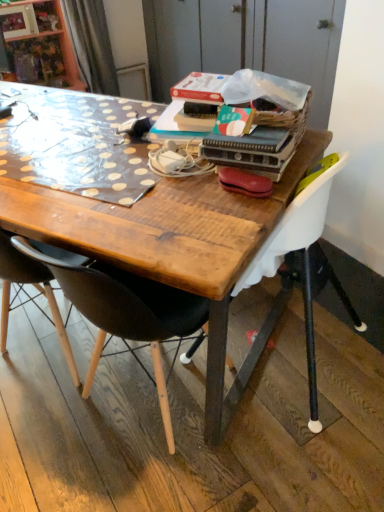
Find the location of a particular element. This screenshot has height=512, width=384. free space between white plastic chair at upper right, placed as the second chair when sorted from left to right, and wooden desk at center is located at coordinates (271, 415).